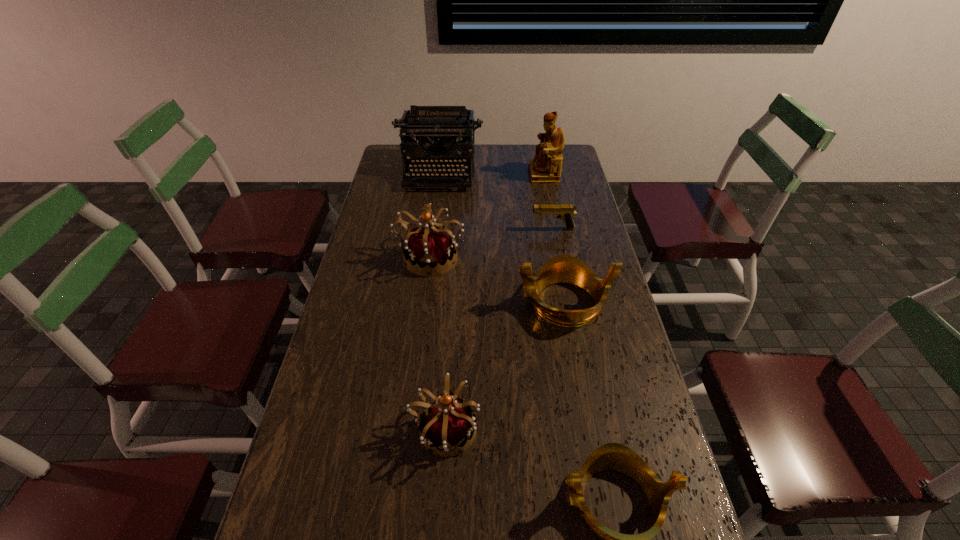
Identify the location of tiara that stands as the third closest to the bigger red tiara. (612, 456).

I want to click on gold tiara object that ranks as the closest to the nearer red tiara, so click(x=612, y=456).